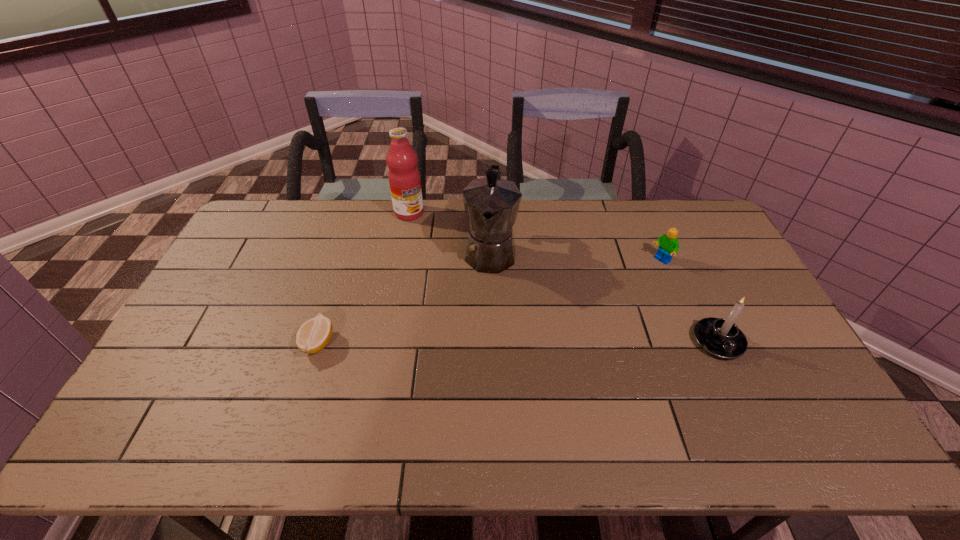
Identify the location of vacant space that satisfies the following two spatial constraints: 1. on the back side of the fourth tallest object; 2. on the right side of the shortest object. Image resolution: width=960 pixels, height=540 pixels. (345, 261).